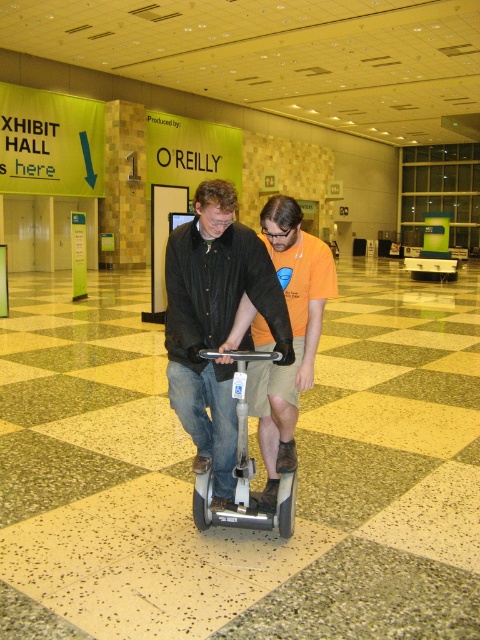
Question: Does matte black scooter at center have a larger size compared to silver metallic scooter at center?

Choices:
 (A) yes
 (B) no

Answer: (A)

Question: Which object is the closest to the silver metallic scooter at center?

Choices:
 (A) matte black scooter at center
 (B) orange cotton t-shirt at center

Answer: (A)

Question: Which of the following is the closest to the observer?

Choices:
 (A) orange cotton t-shirt at center
 (B) matte black scooter at center
 (C) silver metallic scooter at center

Answer: (C)

Question: In this image, where is orange cotton t-shirt at center located relative to silver metallic scooter at center?

Choices:
 (A) left
 (B) right

Answer: (B)

Question: Does matte black scooter at center have a lesser width compared to orange cotton t-shirt at center?

Choices:
 (A) no
 (B) yes

Answer: (A)

Question: Which of the following is the farthest from the observer?

Choices:
 (A) matte black scooter at center
 (B) silver metallic scooter at center
 (C) orange cotton t-shirt at center

Answer: (C)